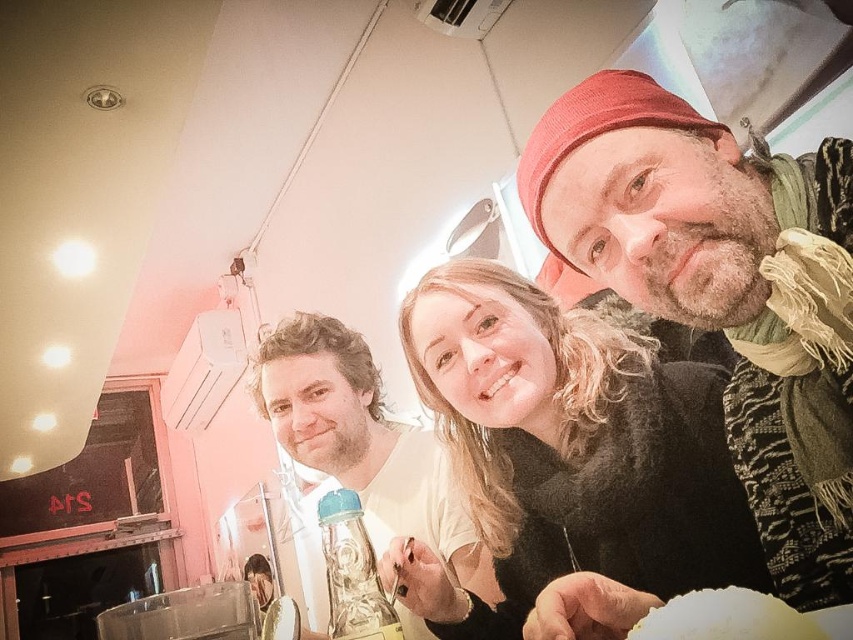
You are a photographer trying to capture a group photo of the knitted wool hat at upper right and the matte white shirt at center. Which object should you focus on first if you want to ensure both are in focus, considering their heights?

You should focus on the matte white shirt at center first because it is taller than the knitted wool hat at upper right, ensuring both can be in focus by adjusting the camera accordingly.

You are a photographer trying to capture a group photo. You notice the blonde hair at center and the knitted wool hat at upper right. Which object is located lower in the image?

The blonde hair at center is positioned under the knitted wool hat at upper right, so the blonde hair at center is lower in the image.